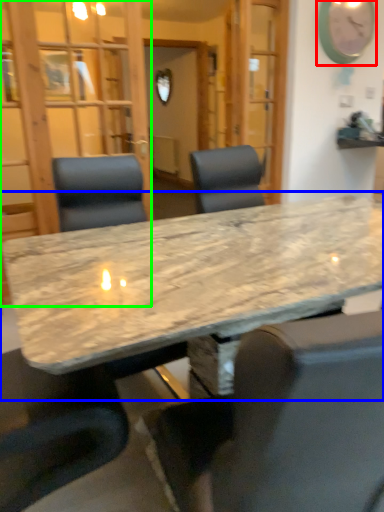
Question: Which object is the closest to the clock (highlighted by a red box)? Choose among these: table (highlighted by a blue box) or glass door (highlighted by a green box).

Choices:
 (A) table
 (B) glass door

Answer: (B)